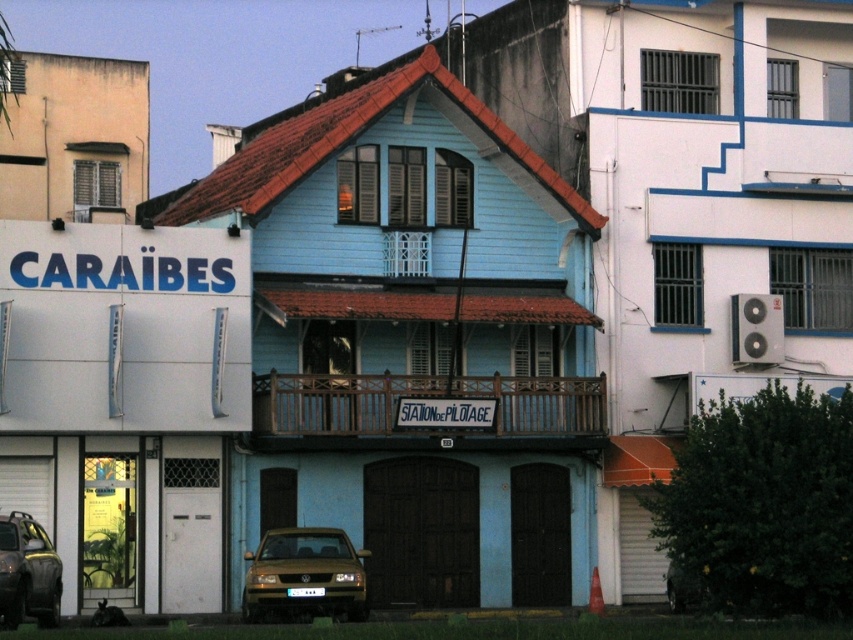
Locate an element on the screen. gold metallic car at lower center is located at coordinates (305, 576).

Locate an element on the screen. This screenshot has width=853, height=640. gold metallic car at lower center is located at coordinates (305, 576).